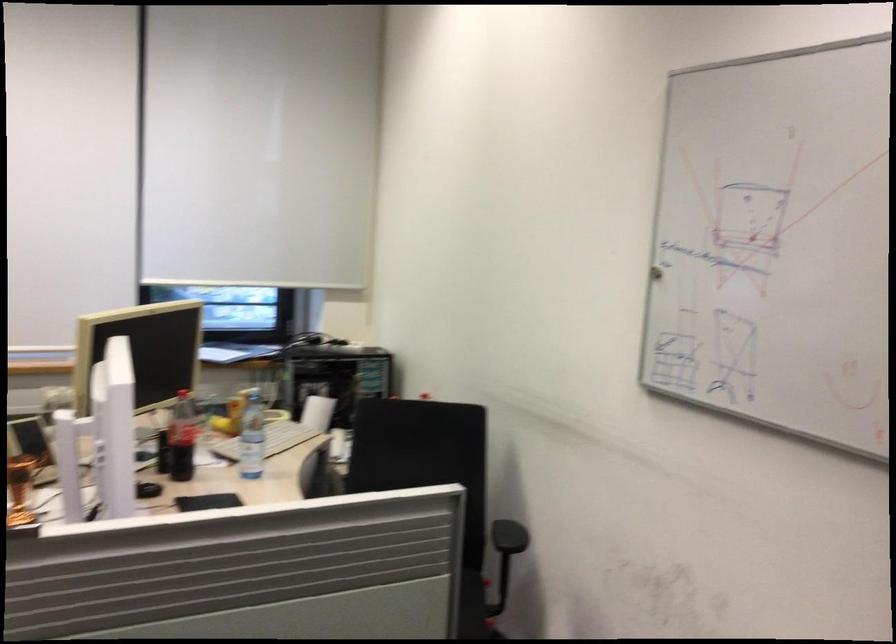
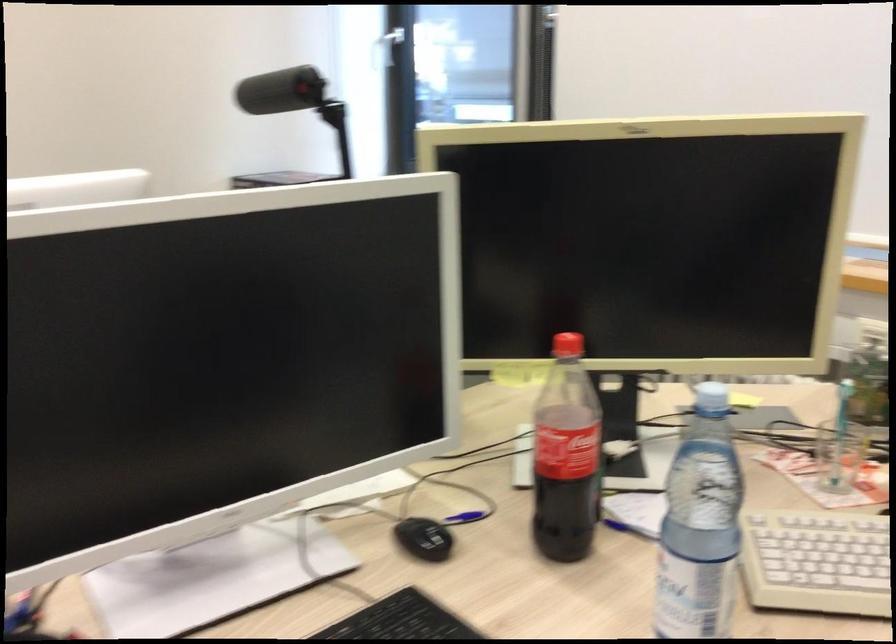
Locate, in the second image, the point that corresponds to [174,433] in the first image.

(565, 456)